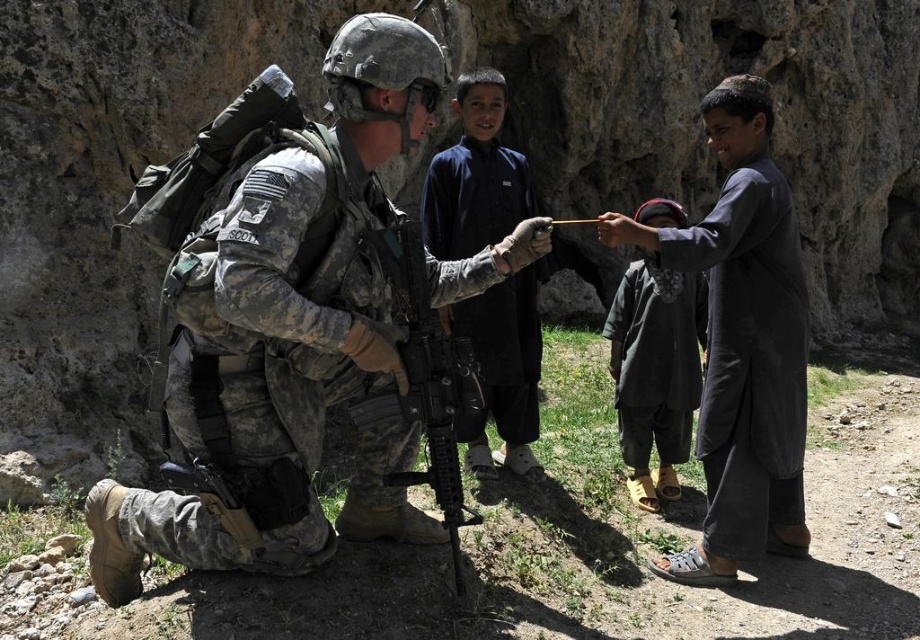
Can you confirm if dark blue cotton shirt at center is shorter than matte black rifle at center?

Incorrect, dark blue cotton shirt at center's height does not fall short of matte black rifle at center's.

In the scene shown: Can you confirm if dark blue cotton shirt at center is wider than matte black rifle at center?

Correct, the width of dark blue cotton shirt at center exceeds that of matte black rifle at center.

Does point (526, 168) come farther from viewer compared to point (400, 232)?

Yes, point (526, 168) is farther from viewer.

You are a GUI agent. You are given a task and a screenshot of the screen. Output one action in this format:
    pyautogui.click(x=<x>, y=<y>)
    Task: Click on the dark blue cotton shirt at center
    
    Given the screenshot: What is the action you would take?
    pyautogui.click(x=475, y=176)

Is camouflage uniform at center positioned at the back of dark gray fabric at right?

No.

Who is more distant from viewer, (184, 252) or (792, 493)?

The point (792, 493) is behind.

Does point (399, 90) come farther from viewer compared to point (706, 410)?

No, it is not.

I want to click on camouflage uniform at center, so click(296, 323).

Looking at this image, which of these two, camouflage uniform at center or dark gray fabric cap at right, stands taller?

camouflage uniform at center

Who is more forward, (244, 520) or (667, 444)?

Point (244, 520)

In order to click on camouflage uniform at center in this screenshot , I will do `click(296, 323)`.